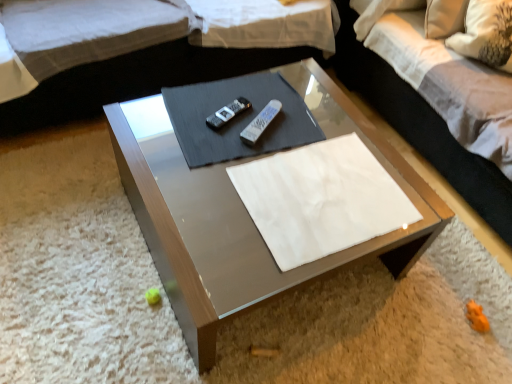
Find the location of `free space to the left of white paper at center`. free space to the left of white paper at center is located at coordinates (201, 170).